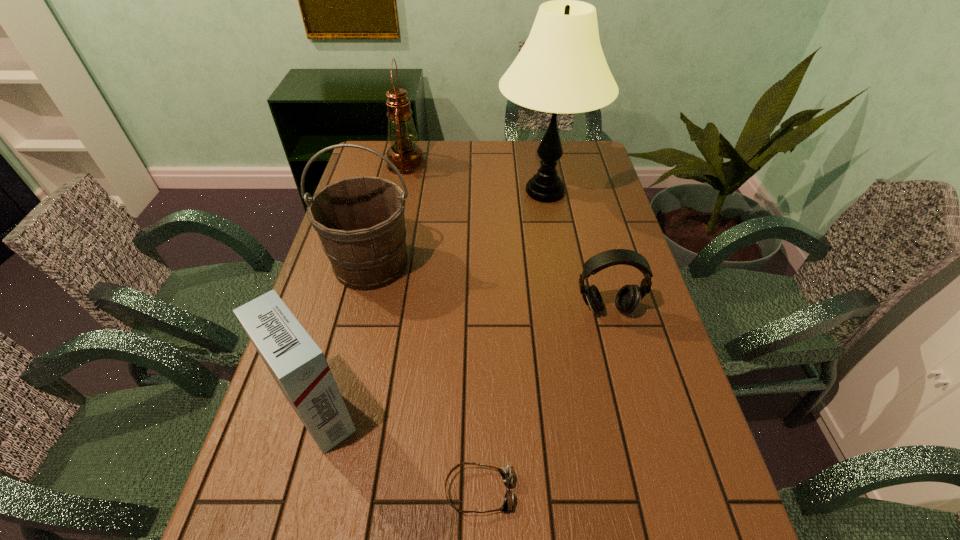
Locate an element on the screen. lamp that is positioned at the right edge is located at coordinates (561, 68).

Locate an element on the screen. earphone located at the right edge is located at coordinates (628, 298).

Locate an element on the screen. Image resolution: width=960 pixels, height=540 pixels. object that is at the far left corner is located at coordinates (404, 153).

Find the location of `object that is at the far right corner`. object that is at the far right corner is located at coordinates (561, 68).

This screenshot has width=960, height=540. Find the location of `blank space at the far edge of the desktop`. blank space at the far edge of the desktop is located at coordinates (456, 150).

I want to click on free location at the left edge of the desktop, so click(x=355, y=330).

Find the location of a particular element. This screenshot has width=960, height=540. free spot at the right edge of the desktop is located at coordinates (655, 319).

Locate an element on the screen. vacant space at the far right corner is located at coordinates (574, 153).

This screenshot has width=960, height=540. I want to click on empty location between the fifth farthest object and the lamp, so click(431, 301).

This screenshot has height=540, width=960. I want to click on vacant space that's between the fourth nearest object and the nearest object, so click(425, 377).